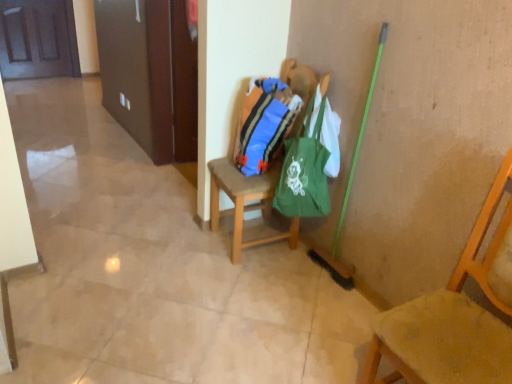
Question: From the image's perspective, is wooden chair at center, which is the first chair in left-to-right order, located beneath wooden door at upper left?

Choices:
 (A) no
 (B) yes

Answer: (B)

Question: Is wooden door at upper left inside wooden chair at center, which is the first chair in left-to-right order?

Choices:
 (A) yes
 (B) no

Answer: (B)

Question: From the image's perspective, is wooden chair at center, which is counted as the first chair, starting from the back, over wooden door at upper left?

Choices:
 (A) yes
 (B) no

Answer: (B)

Question: Can you confirm if wooden chair at center, which is counted as the first chair, starting from the back, is shorter than wooden door at upper left?

Choices:
 (A) no
 (B) yes

Answer: (A)

Question: Considering the relative positions of wooden chair at center, which is the first chair in left-to-right order, and wooden door at upper left in the image provided, is wooden chair at center, which is the first chair in left-to-right order, to the right of wooden door at upper left from the viewer's perspective?

Choices:
 (A) yes
 (B) no

Answer: (A)

Question: Can you confirm if wooden chair at center, which is counted as the first chair, starting from the back, is bigger than wooden door at upper left?

Choices:
 (A) no
 (B) yes

Answer: (B)

Question: Is wooden chair at center, positioned as the second chair in front-to-back order, to the right of blue striped fabric bag at center from the viewer's perspective?

Choices:
 (A) yes
 (B) no

Answer: (B)

Question: Considering the relative sizes of wooden chair at center, positioned as the second chair in front-to-back order, and blue striped fabric bag at center in the image provided, is wooden chair at center, positioned as the second chair in front-to-back order, shorter than blue striped fabric bag at center?

Choices:
 (A) no
 (B) yes

Answer: (A)

Question: Is wooden chair at center, which is counted as the first chair, starting from the back, closer to the viewer compared to blue striped fabric bag at center?

Choices:
 (A) no
 (B) yes

Answer: (B)

Question: Is wooden chair at center, which is counted as the first chair, starting from the back, further to the viewer compared to blue striped fabric bag at center?

Choices:
 (A) no
 (B) yes

Answer: (A)

Question: From the image's perspective, is wooden chair at center, positioned as the second chair in front-to-back order, beneath blue striped fabric bag at center?

Choices:
 (A) no
 (B) yes

Answer: (B)

Question: Is wooden chair at center, which ranks as the 2th chair in right-to-left order, beside blue striped fabric bag at center?

Choices:
 (A) yes
 (B) no

Answer: (B)

Question: Are wooden chair at right, the 2th chair viewed from the left, and green canvas tote at center far apart?

Choices:
 (A) yes
 (B) no

Answer: (B)